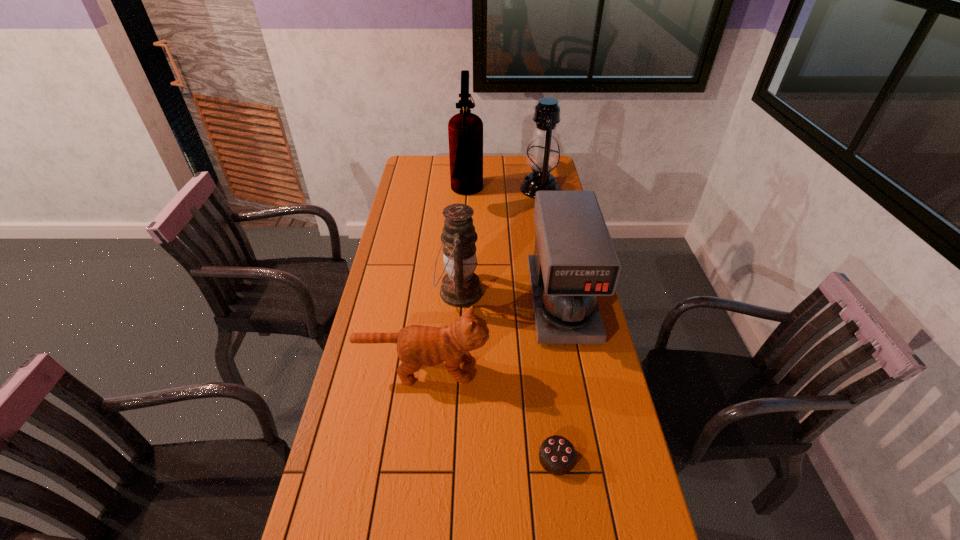
At what (x,y) coordinates should I click in order to perform the action: click on chocolate cake located at the right edge. Please return your answer as a coordinate pair (x, y). Looking at the image, I should click on (557, 455).

At what (x,y) coordinates should I click in order to perform the action: click on object that is at the far right corner. Please return your answer as a coordinate pair (x, y). This screenshot has height=540, width=960. Looking at the image, I should click on (543, 156).

Identify the location of vacant space at the left edge. (324, 519).

Where is `free space between the tallest object and the coffee maker`? The image size is (960, 540). free space between the tallest object and the coffee maker is located at coordinates (515, 248).

The width and height of the screenshot is (960, 540). I want to click on vacant space in between the fifth tallest object and the nearest object, so click(490, 414).

The width and height of the screenshot is (960, 540). In order to click on vacant area that lies between the cat and the right lantern in this screenshot , I will do `click(481, 279)`.

Where is `vacant space that's between the coffee maker and the nearer lantern`? Image resolution: width=960 pixels, height=540 pixels. vacant space that's between the coffee maker and the nearer lantern is located at coordinates (510, 297).

Locate an element on the screen. This screenshot has width=960, height=540. empty location between the farther lantern and the cat is located at coordinates (481, 279).

Image resolution: width=960 pixels, height=540 pixels. I want to click on empty location between the right lantern and the tallest object, so click(503, 192).

Where is `free space between the coffee maker and the fire extinguisher`? The image size is (960, 540). free space between the coffee maker and the fire extinguisher is located at coordinates (515, 248).